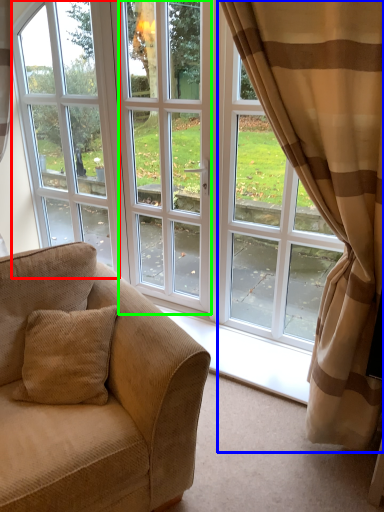
Question: Considering the real-world distances, which object is closest to window frame (highlighted by a red box)? curtain (highlighted by a blue box) or screen door (highlighted by a green box).

Choices:
 (A) curtain
 (B) screen door

Answer: (B)